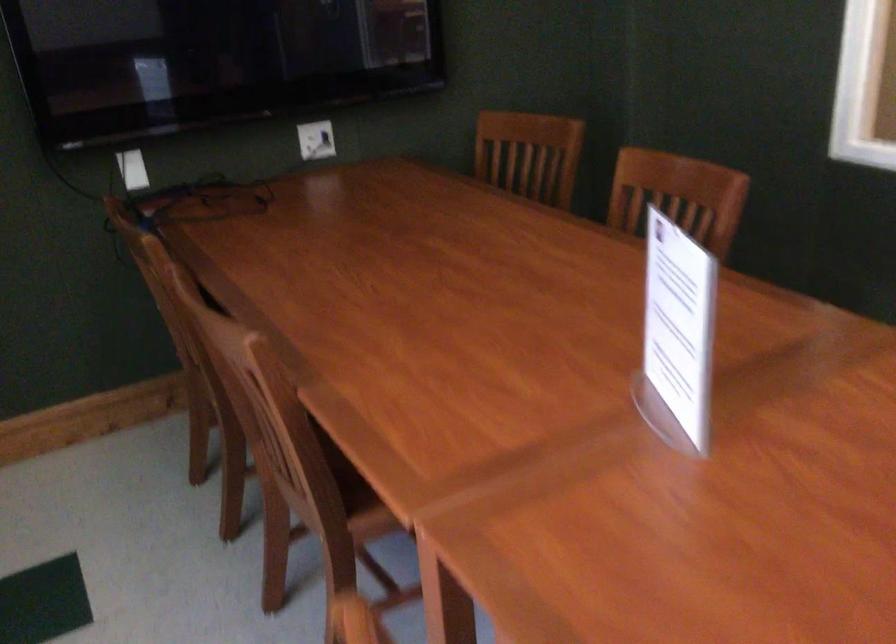
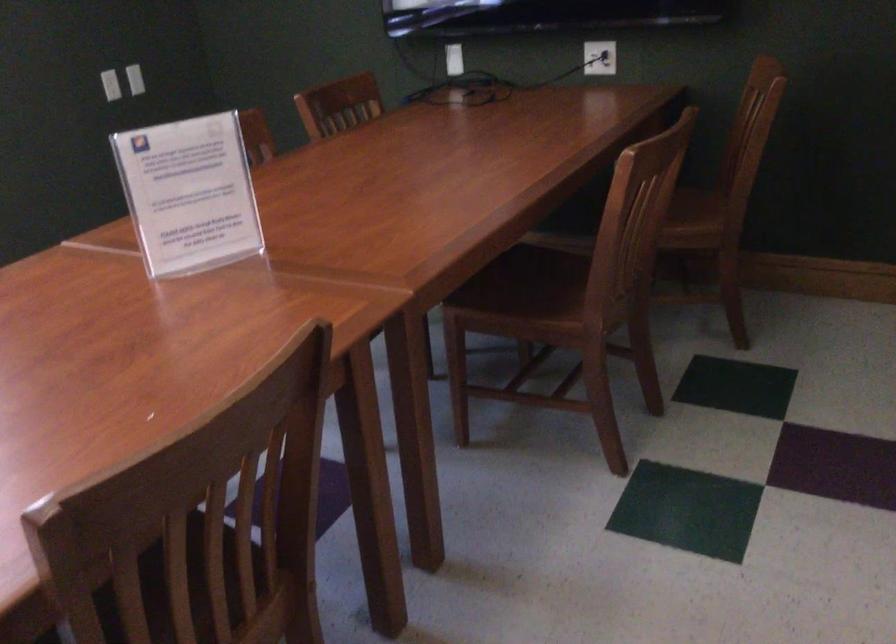
The point at (157,169) is marked in the first image. Where is the corresponding point in the second image?

(453, 59)